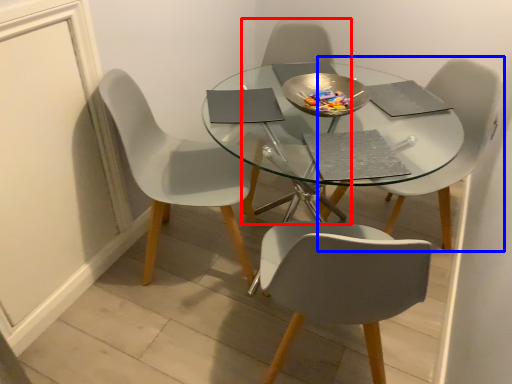
Question: Which object appears farthest to the camera in this image, chair (highlighted by a red box) or chair (highlighted by a blue box)?

Choices:
 (A) chair
 (B) chair

Answer: (A)